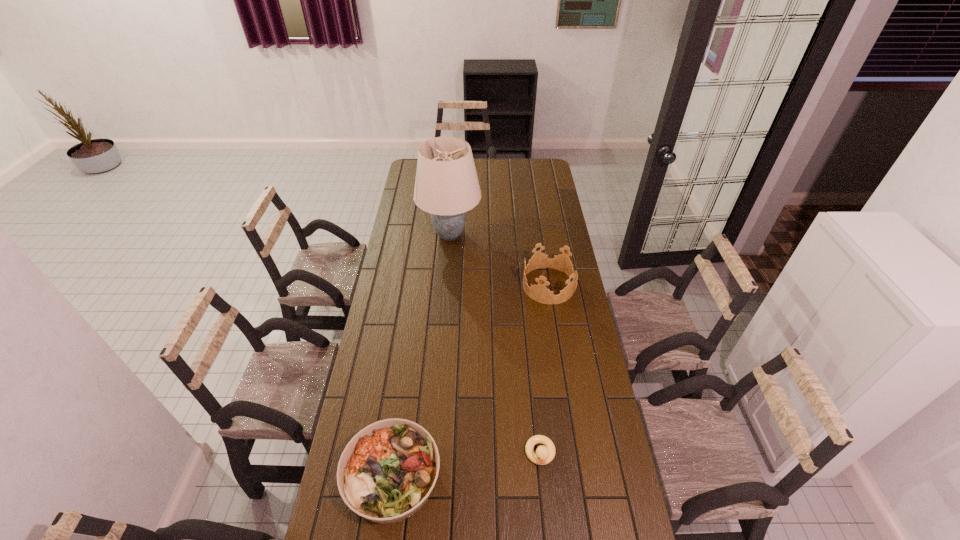
Locate an element on the screen. This screenshot has width=960, height=540. empty location between the shortest object and the third tallest object is located at coordinates (467, 465).

You are a GUI agent. You are given a task and a screenshot of the screen. Output one action in this format:
    pyautogui.click(x=<x>, y=<y>)
    Task: Click on the unoccupied position between the duckling and the tiara
    The width and height of the screenshot is (960, 540).
    Given the screenshot: What is the action you would take?
    pyautogui.click(x=544, y=369)

In order to click on free space between the second shortest object and the tallest object in this screenshot , I will do `click(421, 356)`.

Where is `free spot between the tiara and the shortest object`? Image resolution: width=960 pixels, height=540 pixels. free spot between the tiara and the shortest object is located at coordinates (544, 369).

Identify the location of empty space that is in between the farthest object and the second shortest object. (421, 356).

Locate an element on the screen. The image size is (960, 540). object that is the closest to the shortest object is located at coordinates (386, 473).

Locate an element on the screen. Image resolution: width=960 pixels, height=540 pixels. object that can be found as the second closest to the farthest object is located at coordinates (386, 473).

This screenshot has height=540, width=960. I want to click on free region that satisfies the following two spatial constraints: 1. on the front-facing side of the second tallest object; 2. at the beak of the duckling, so click(x=576, y=454).

The height and width of the screenshot is (540, 960). I want to click on free spot that satisfies the following two spatial constraints: 1. on the front-facing side of the tiara; 2. on the front side of the third tallest object, so click(x=579, y=476).